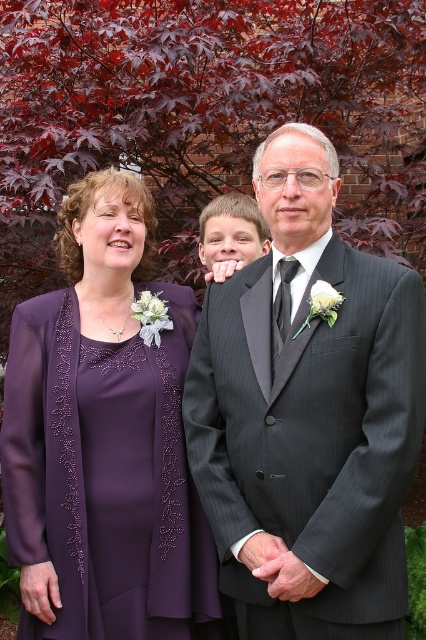
Question: Is purple satin dress at left above matte gray suit at center?

Choices:
 (A) no
 (B) yes

Answer: (A)

Question: Is purple satin dress at left bigger than matte gray suit at center?

Choices:
 (A) yes
 (B) no

Answer: (A)

Question: Which of the following is the farthest from the observer?

Choices:
 (A) matte gray suit at center
 (B) dark gray pinstripe suit at center

Answer: (A)

Question: Does dark gray pinstripe suit at center lie behind matte gray suit at center?

Choices:
 (A) no
 (B) yes

Answer: (A)

Question: Which point appears farthest from the camera in this image?

Choices:
 (A) pyautogui.click(x=104, y=548)
 (B) pyautogui.click(x=278, y=131)

Answer: (A)

Question: Which of the following is the closest to the observer?

Choices:
 (A) (207, 218)
 (B) (394, 332)
 (C) (138, 611)

Answer: (B)